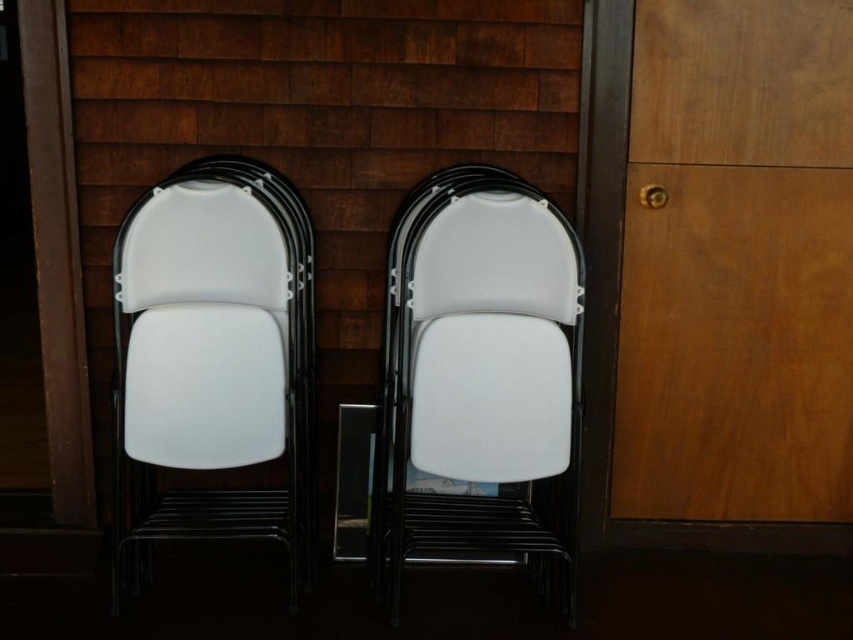
You are standing in a room with a wooden wall and need to place a new chair exactly at the center of the image. The existing white plastic chair at center is already positioned at coordinates 0.588, 0.562. Can you place your new chair at the exact center without overlapping it?

The white plastic chair at center is already located at the center coordinates of the image, so placing another chair there would cause overlap. Choose a different spot to avoid overlapping.

You are organizing a small event and need to move the white plastic chair at left and the white plastic chair at center. Which chair should you move first to access the other without disturbing the stack?

You should move the white plastic chair at center first because the white plastic chair at left is behind it, so removing the center chair would allow access to the left one without disturbing the stack.

You are setting up chairs for an event and need to know which chair is narrower. Which one between the white plastic chair at center and the white plastic chair at left is narrower?

The white plastic chair at center is narrower than the white plastic chair at left.